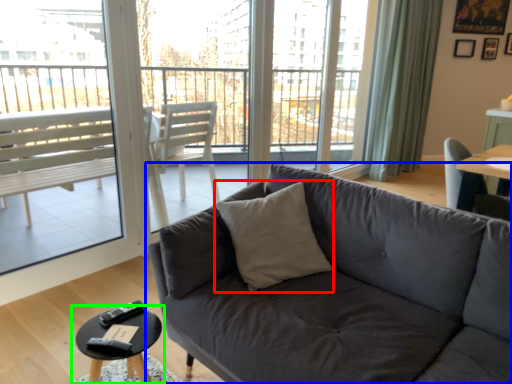
Question: Which is farther away from throw pillow (highlighted by a red box)? studio couch (highlighted by a blue box) or coffee table (highlighted by a green box)?

Choices:
 (A) studio couch
 (B) coffee table

Answer: (B)